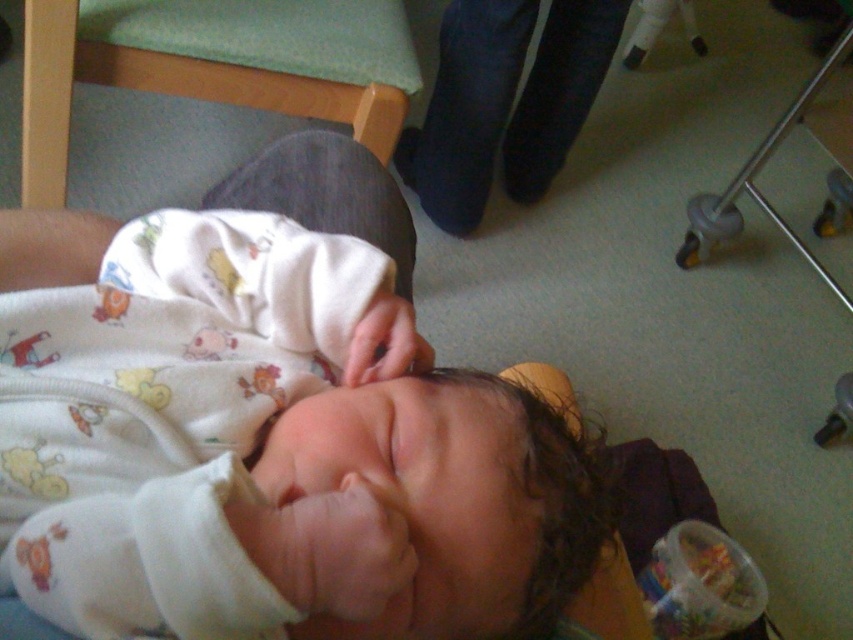
Question: Estimate the real-world distances between objects in this image. Which object is farther from the white soft fabric newborn at center?

Choices:
 (A) smooth skin hand at center
 (B) dark blue jeans at upper center

Answer: (B)

Question: Does dark blue jeans at upper center appear over smooth skin hand at center?

Choices:
 (A) no
 (B) yes

Answer: (B)

Question: Is dark blue jeans at upper center below smooth skin hand at center?

Choices:
 (A) no
 (B) yes

Answer: (A)

Question: Estimate the real-world distances between objects in this image. Which object is farther from the dark blue jeans at upper center?

Choices:
 (A) white soft fabric newborn at center
 (B) smooth skin hand at center

Answer: (B)

Question: Can you confirm if white soft fabric newborn at center is positioned below smooth skin hand at center?

Choices:
 (A) no
 (B) yes

Answer: (B)

Question: Among these objects, which one is farthest from the camera?

Choices:
 (A) smooth skin hand at center
 (B) dark blue jeans at upper center

Answer: (B)